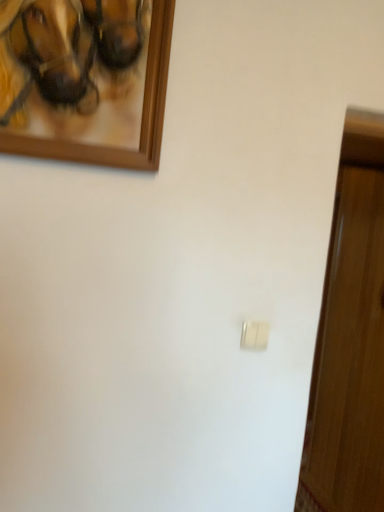
What do you see at coordinates (254, 335) in the screenshot? The image size is (384, 512). I see `white plastic light switch at center` at bounding box center [254, 335].

The height and width of the screenshot is (512, 384). I want to click on white plastic light switch at center, so click(x=254, y=335).

What do you see at coordinates (85, 79) in the screenshot? I see `wooden picture frame at upper left` at bounding box center [85, 79].

Where is `wooden picture frame at upper left`? This screenshot has height=512, width=384. wooden picture frame at upper left is located at coordinates (85, 79).

Find the location of a particular element. Image resolution: width=384 pixels, height=512 pixels. white plastic light switch at center is located at coordinates (254, 335).

Considering the positions of objects wooden picture frame at upper left and white plastic light switch at center in the image provided, who is more to the right, wooden picture frame at upper left or white plastic light switch at center?

Positioned to the right is white plastic light switch at center.

Is the depth of wooden picture frame at upper left greater than that of white plastic light switch at center?

No, the depth of wooden picture frame at upper left is less than that of white plastic light switch at center.

Which is behind, point (62, 10) or point (241, 342)?

The point (241, 342) is farther from the camera.

From the image's perspective, between wooden picture frame at upper left and white plastic light switch at center, which one is located above?

wooden picture frame at upper left.

From a real-world perspective, is wooden picture frame at upper left over white plastic light switch at center?

Yes, from a real-world perspective, wooden picture frame at upper left is over white plastic light switch at center

Between wooden picture frame at upper left and white plastic light switch at center, which one has larger width?

Wider between the two is wooden picture frame at upper left.

From the picture: Which of these two, wooden picture frame at upper left or white plastic light switch at center, stands taller?

With more height is wooden picture frame at upper left.

In terms of size, does wooden picture frame at upper left appear bigger or smaller than white plastic light switch at center?

Considering their sizes, wooden picture frame at upper left takes up more space than white plastic light switch at center.

Which is correct: wooden picture frame at upper left is inside white plastic light switch at center, or outside of it?

wooden picture frame at upper left cannot be found inside white plastic light switch at center.

Is wooden picture frame at upper left beside white plastic light switch at center?

No, wooden picture frame at upper left is not with white plastic light switch at center.

Is wooden picture frame at upper left oriented towards white plastic light switch at center?

No, wooden picture frame at upper left is not aimed at white plastic light switch at center.

Locate an element on the screen. This screenshot has height=512, width=384. light switch lying on the right of wooden picture frame at upper left is located at coordinates (254, 335).

Which is more to the left, white plastic light switch at center or wooden picture frame at upper left?

From the viewer's perspective, wooden picture frame at upper left appears more on the left side.

Is white plastic light switch at center positioned in front of wooden picture frame at upper left?

No.

Which is in front, point (254, 335) or point (40, 91)?

Point (40, 91)

From the image's perspective, is white plastic light switch at center above or below wooden picture frame at upper left?

Clearly, from the image's perspective, white plastic light switch at center is below wooden picture frame at upper left.

From a real-world perspective, is white plastic light switch at center beneath wooden picture frame at upper left?

Indeed, from a real-world perspective, white plastic light switch at center is positioned beneath wooden picture frame at upper left.

Considering the sizes of white plastic light switch at center and wooden picture frame at upper left in the image, is white plastic light switch at center wider or thinner than wooden picture frame at upper left?

Clearly, white plastic light switch at center has less width compared to wooden picture frame at upper left.

Is white plastic light switch at center taller or shorter than wooden picture frame at upper left?

white plastic light switch at center is shorter than wooden picture frame at upper left.

Can you confirm if white plastic light switch at center is bigger than wooden picture frame at upper left?

Incorrect, white plastic light switch at center is not larger than wooden picture frame at upper left.

Do you think white plastic light switch at center is within wooden picture frame at upper left, or outside of it?

white plastic light switch at center is outside wooden picture frame at upper left.

Is white plastic light switch at center positioned far away from wooden picture frame at upper left?

No, there isn't a large distance between white plastic light switch at center and wooden picture frame at upper left.

Could you tell me if white plastic light switch at center is facing wooden picture frame at upper left?

No, white plastic light switch at center is not oriented towards wooden picture frame at upper left.

Locate an element on the screen. The height and width of the screenshot is (512, 384). light switch on the right side of wooden picture frame at upper left is located at coordinates (254, 335).

Find the location of a particular element. Image resolution: width=384 pixels, height=512 pixels. light switch that is on the right side of wooden picture frame at upper left is located at coordinates (254, 335).

Locate an element on the screen. light switch behind the wooden picture frame at upper left is located at coordinates (254, 335).